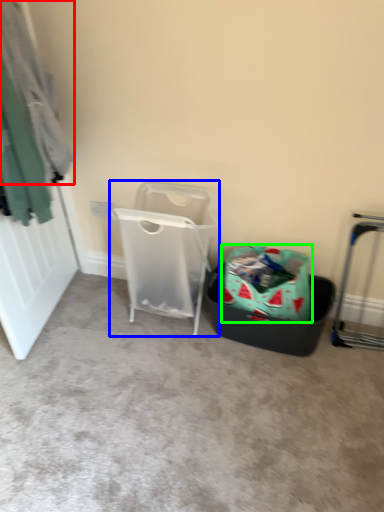
Question: Which is farther away from clothing (highlighted by a red box)? waste container (highlighted by a blue box) or shopping bag (highlighted by a green box)?

Choices:
 (A) waste container
 (B) shopping bag

Answer: (B)